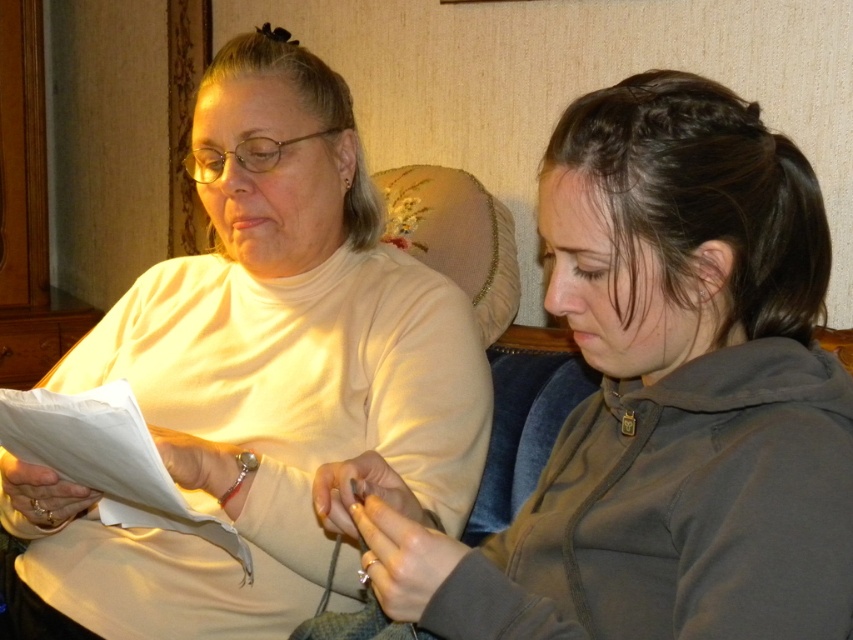
Question: From the image, what is the correct spatial relationship of matte gray hoodie at right in relation to white paper at left?

Choices:
 (A) right
 (B) left

Answer: (A)

Question: Among these points, which one is farthest from the camera?

Choices:
 (A) (625, 128)
 (B) (155, 481)

Answer: (B)

Question: From the image, what is the correct spatial relationship of matte gray hoodie at right in relation to white paper at left?

Choices:
 (A) right
 (B) left

Answer: (A)

Question: Which of the following is the closest to the observer?

Choices:
 (A) matte white sweater at center
 (B) white paper at left

Answer: (B)

Question: Can you confirm if matte gray hoodie at right is smaller than white paper at left?

Choices:
 (A) yes
 (B) no

Answer: (B)

Question: Which point appears closest to the camera in this image?

Choices:
 (A) (274, 522)
 (B) (770, 208)
 (C) (136, 477)

Answer: (B)